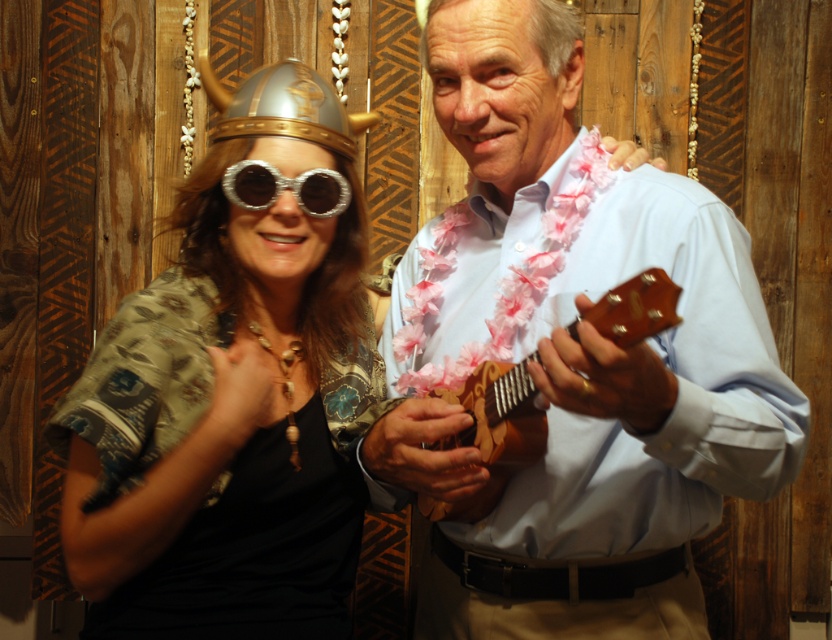
Is wooden ukulele at center shorter than silver metallic helmet at upper left?

In fact, wooden ukulele at center may be taller than silver metallic helmet at upper left.

Is wooden ukulele at center wider than silver metallic helmet at upper left?

In fact, wooden ukulele at center might be narrower than silver metallic helmet at upper left.

Image resolution: width=832 pixels, height=640 pixels. Describe the element at coordinates (498, 416) in the screenshot. I see `wooden ukulele at center` at that location.

Locate an element on the screen. The height and width of the screenshot is (640, 832). wooden ukulele at center is located at coordinates (498, 416).

Between light blue shirt at center and wooden ukulele at center, which one is positioned lower?

Positioned lower is wooden ukulele at center.

Which is behind, point (642, 518) or point (626, 292)?

Positioned behind is point (642, 518).

Where is `light blue shirt at center`? This screenshot has width=832, height=640. light blue shirt at center is located at coordinates point(612,436).

Is silver metallic helmet at upper left closer to the viewer compared to silver reflective goggles at center?

Yes, silver metallic helmet at upper left is in front of silver reflective goggles at center.

Looking at this image, is silver metallic helmet at upper left wider than silver reflective goggles at center?

Yes.

Is point (261, 99) positioned in front of point (330, 179)?

Yes, it is.

Where is `silver metallic helmet at upper left`? This screenshot has width=832, height=640. silver metallic helmet at upper left is located at coordinates (285, 106).